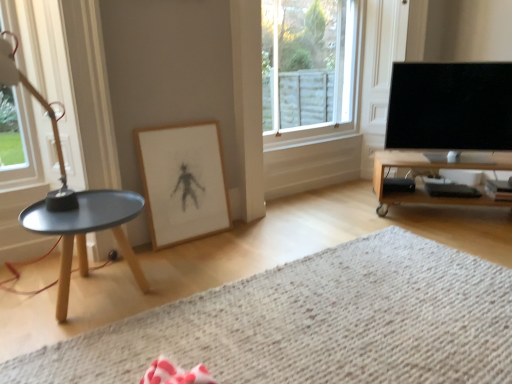
What are the coordinates of `vacant area situated to the left side of matte black tray at left` in the screenshot? It's located at (25, 292).